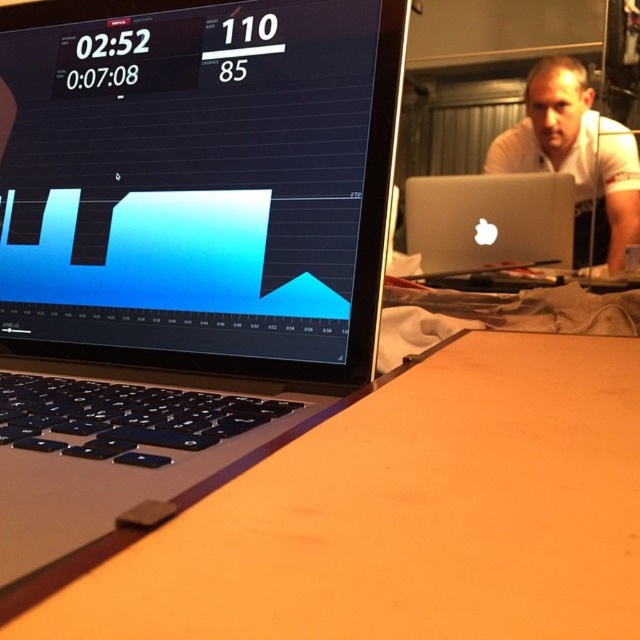
You are a delivery person who needs to place a small package between the matte black laptop at center and the white smooth shirt at upper right. The package is 0.9 meters long. Will it fit in the space between them?

The distance between the matte black laptop at center and the white smooth shirt at upper right is 1.03 meters. Since the package is 0.9 meters long, it will fit in the space between them as it is shorter than the available distance.

You are a fitness trainer observing the laptop screen and the person in the background. You need to check if the white smooth shirt at upper right is covering the silver metallic laptop at center. Based on the scene description, can you determine this?

The white smooth shirt at upper right is positioned over the silver metallic laptop at center, so yes, the shirt is covering the laptop.

You are trying to place a rectangular box that measures 0.3 meters in width on the wooden table at center. Based on the scene description, will the box fit on the table?

The wooden table at center is located at point (406, 515), but the provided information does not specify its dimensions. Therefore, it is impossible to determine if the box will fit based on the given data.